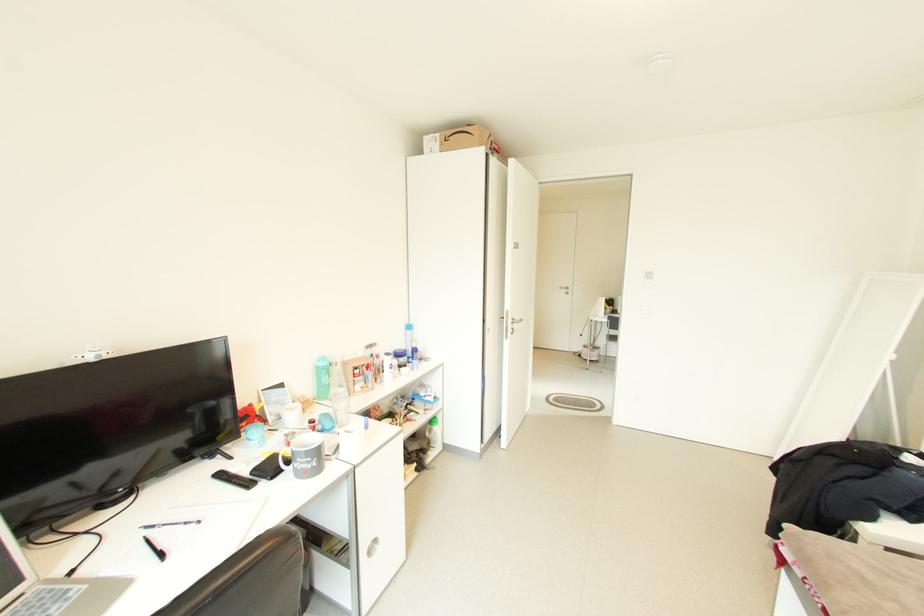
Find where to lift the green water bottle. Please return your answer as a coordinate pair (x, y).

(322, 378)